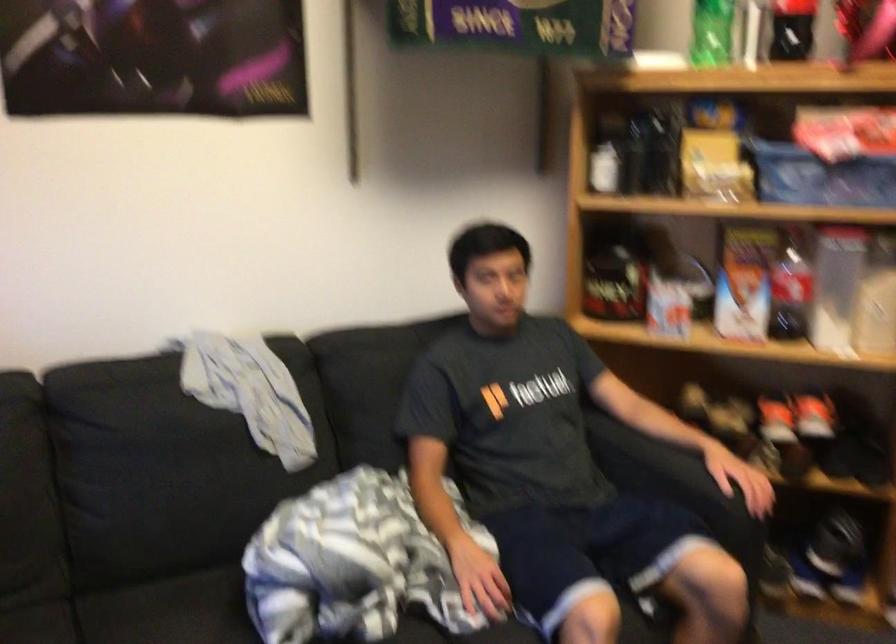
Locate an element on the screen. sofa armrest is located at coordinates (650, 464).